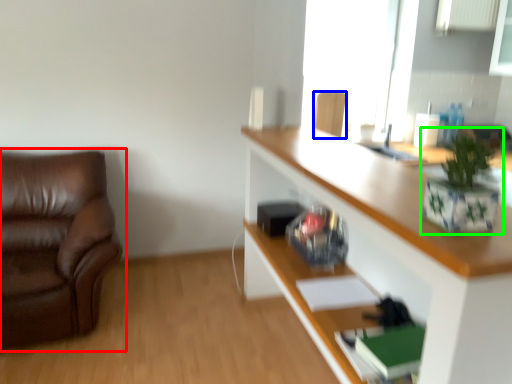
Question: Which object is the closest to the chair (highlighted by a red box)? Choose among these: chair (highlighted by a blue box) or houseplant (highlighted by a green box).

Choices:
 (A) chair
 (B) houseplant

Answer: (A)